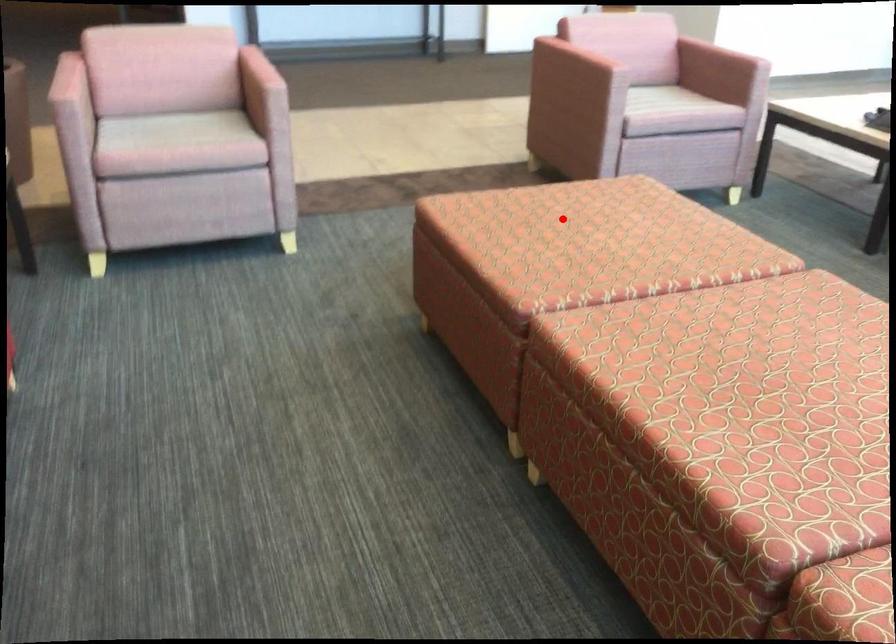
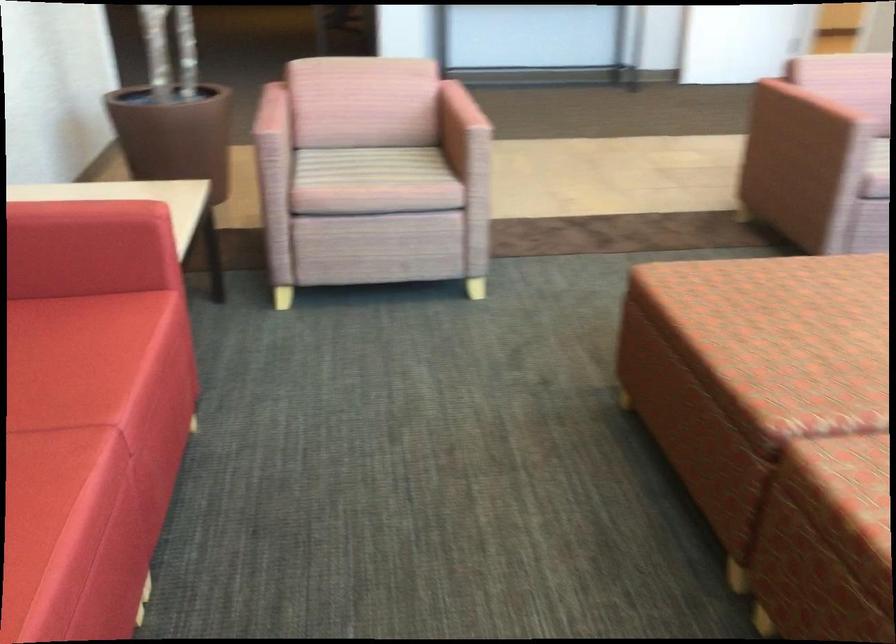
Where in the second image is the point corresponding to the highlighted location from the first image?

(805, 304)